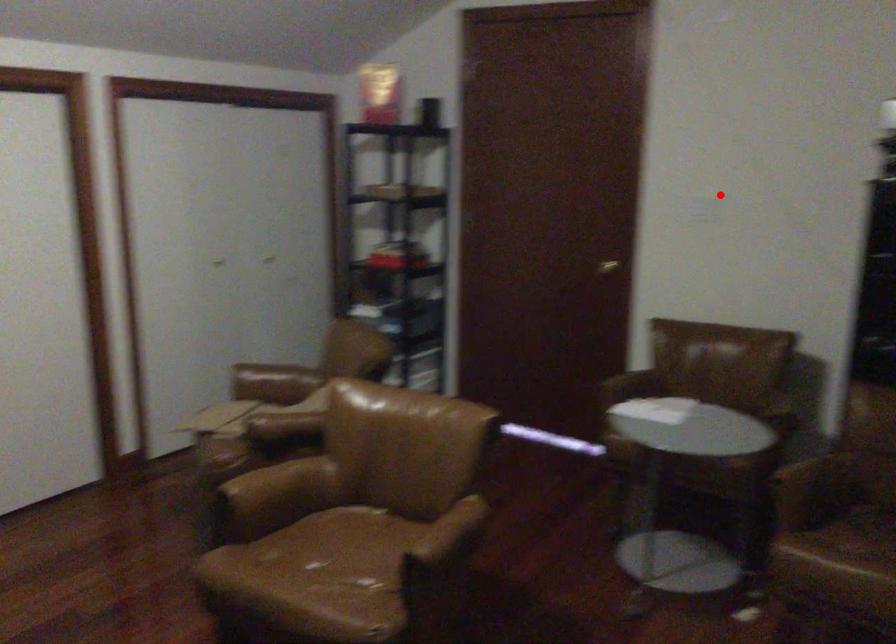
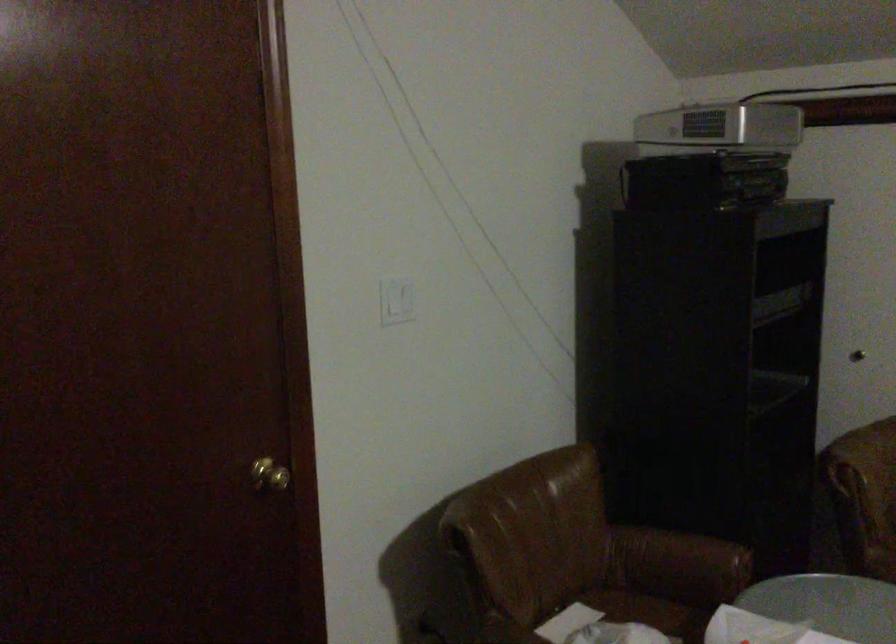
The point at the highlighted location is marked in the first image. Where is the corresponding point in the second image?

(397, 301)